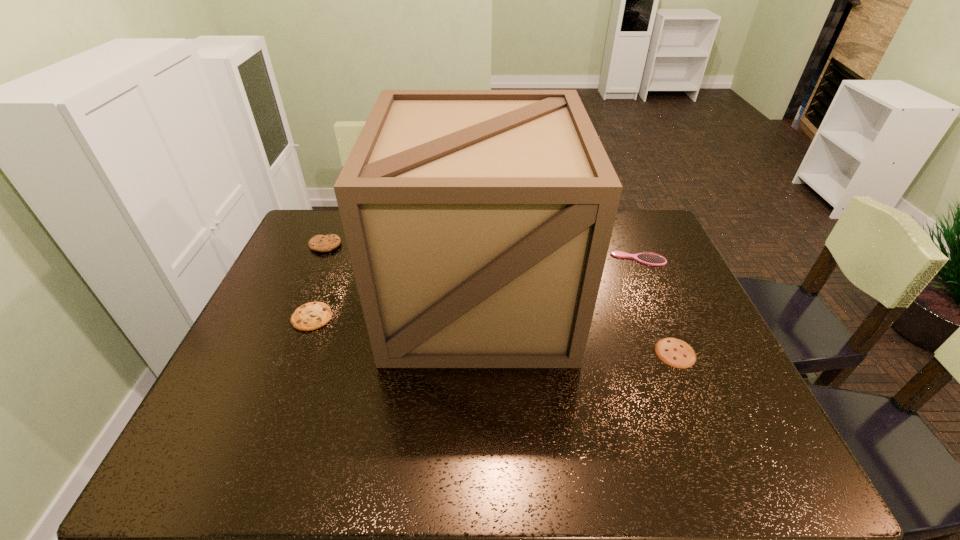
In the image, there is a desktop. What are the coordinates of `vacant space at the left edge` in the screenshot? It's located at (298, 262).

The height and width of the screenshot is (540, 960). Find the location of `vacant space at the far left corner of the desktop`. vacant space at the far left corner of the desktop is located at coordinates (315, 235).

Identify the location of vacant space at the far right corner of the desktop. Image resolution: width=960 pixels, height=540 pixels. (634, 211).

Where is `empty space between the second shortest object and the second tallest object`? Image resolution: width=960 pixels, height=540 pixels. empty space between the second shortest object and the second tallest object is located at coordinates (319, 281).

Select which object is the third closest to the second farthest cookie. Please provide its 2D coordinates. Your answer should be formatted as a tuple, i.e. [(x, y)], where the tuple contains the x and y coordinates of a point satisfying the conditions above.

[(648, 258)]

Select which object appears as the fourth closest to the farthest cookie. Please provide its 2D coordinates. Your answer should be formatted as a tuple, i.e. [(x, y)], where the tuple contains the x and y coordinates of a point satisfying the conditions above.

[(674, 352)]

Identify the location of cookie that stands as the closest to the shortest object. The height and width of the screenshot is (540, 960). (313, 315).

Point out which cookie is positioned as the nearest to the shortest cookie. Please provide its 2D coordinates. Your answer should be formatted as a tuple, i.e. [(x, y)], where the tuple contains the x and y coordinates of a point satisfying the conditions above.

[(313, 315)]

Locate an element on the screen. This screenshot has height=540, width=960. free space that satisfies the following two spatial constraints: 1. on the front side of the tallest object; 2. on the left side of the fourth shortest object is located at coordinates (302, 298).

This screenshot has width=960, height=540. I want to click on blank space that satisfies the following two spatial constraints: 1. on the front side of the third object from left to right; 2. on the left side of the shortest object, so click(x=479, y=353).